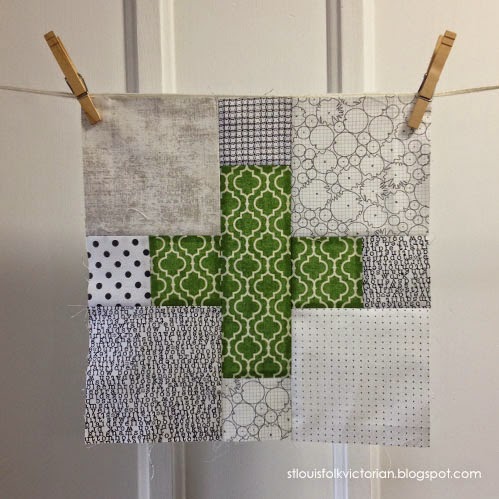
You are a GUI agent. You are given a task and a screenshot of the screen. Output one action in this format:
    pyautogui.click(x=<x>, y=<y>)
    Task: Click on the panels
    
    Given the screenshot: What is the action you would take?
    pyautogui.click(x=353, y=387), pyautogui.click(x=148, y=392), pyautogui.click(x=160, y=222), pyautogui.click(x=364, y=197)